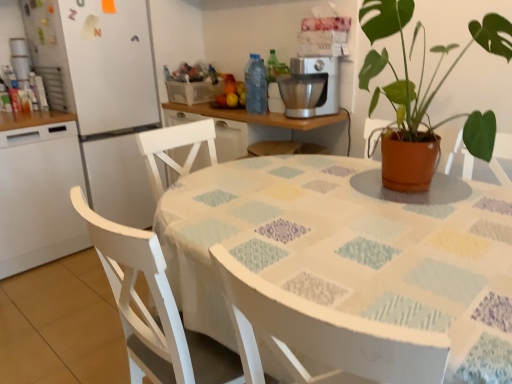
Identify the location of free spot to the left of terracotta pot at upper right. (314, 186).